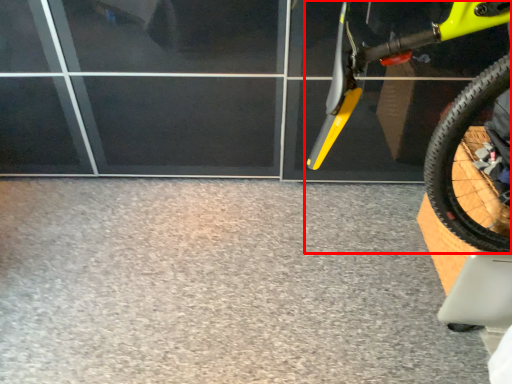
Question: Where is bicycle (annotated by the red box) located in relation to concrete in the image?

Choices:
 (A) left
 (B) right

Answer: (B)